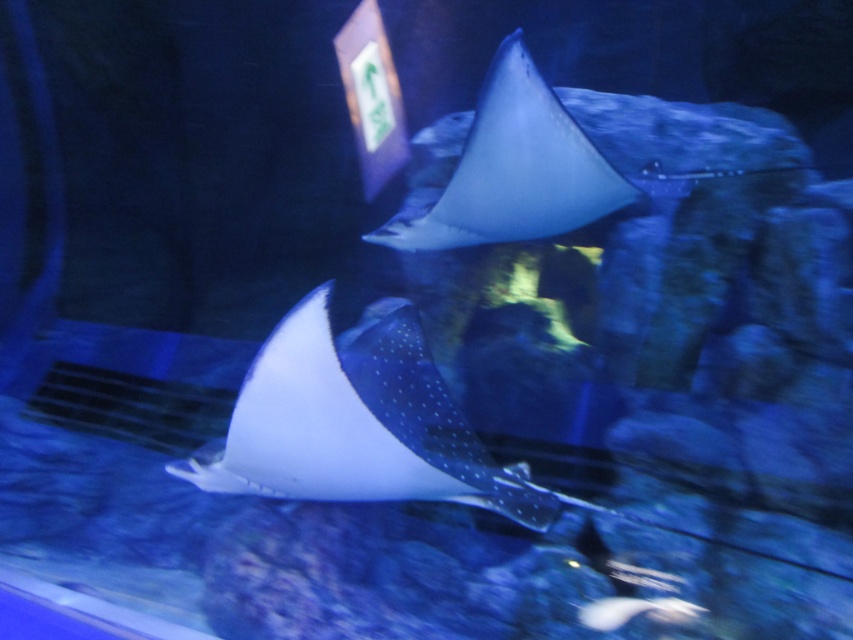
You are a marine biologist observing an aquarium. You notice a point marked at coordinates (357, 422). Based on the scene description, which object is this point located on?

The point marked at coordinates (357, 422) is located on the white dotted stingray at center.

You are an aquarium designer planning to install a feeding station in the aquarium. The station must be placed 0.1 units away from the white dotted stingray at center. Where should you place the feeding station relative to the stingray?

The feeding station should be placed 0.1 units away from the white dotted stingray at center. Since the stingray is at position point (357,422), the feeding station can be placed at either point (357,486) to the right or (357,358) to the left along the horizontal axis, or at point (442,422) above or (271,422) below along the vertical axis, or any diagonal direction maintaining the 0.1 unit distance from the stingray.